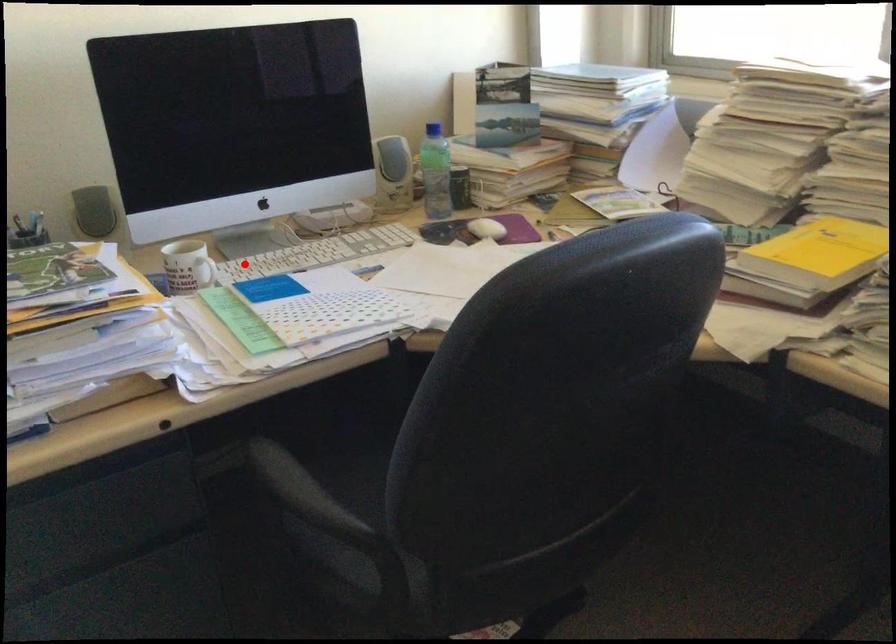
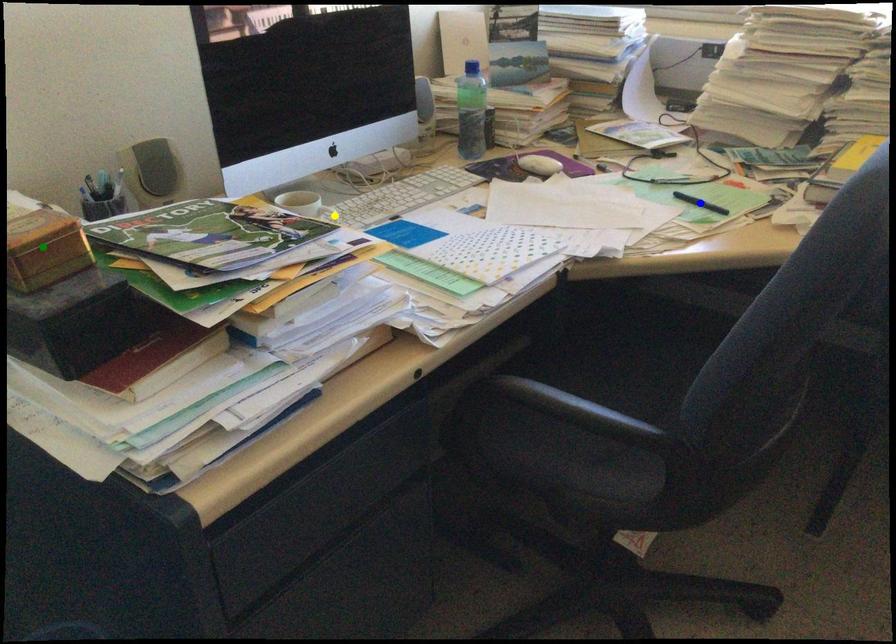
Question: I am providing you with two images of the same scene from different viewpoints. A red point is marked on the first image. You are given multiple points on the second image. Which spot in image 2 lines up with the point in image 1?

Choices:
 (A) blue point
 (B) green point
 (C) yellow point

Answer: (C)